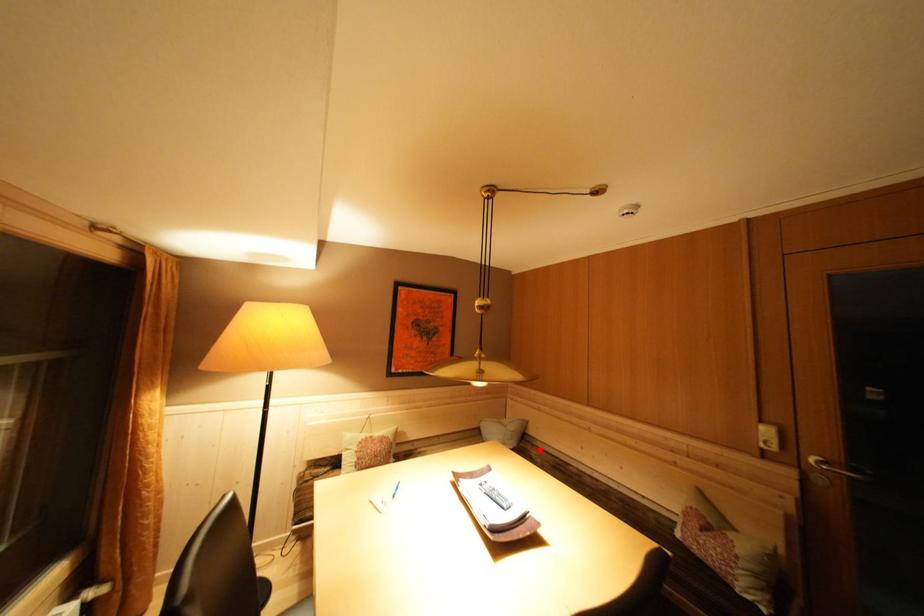
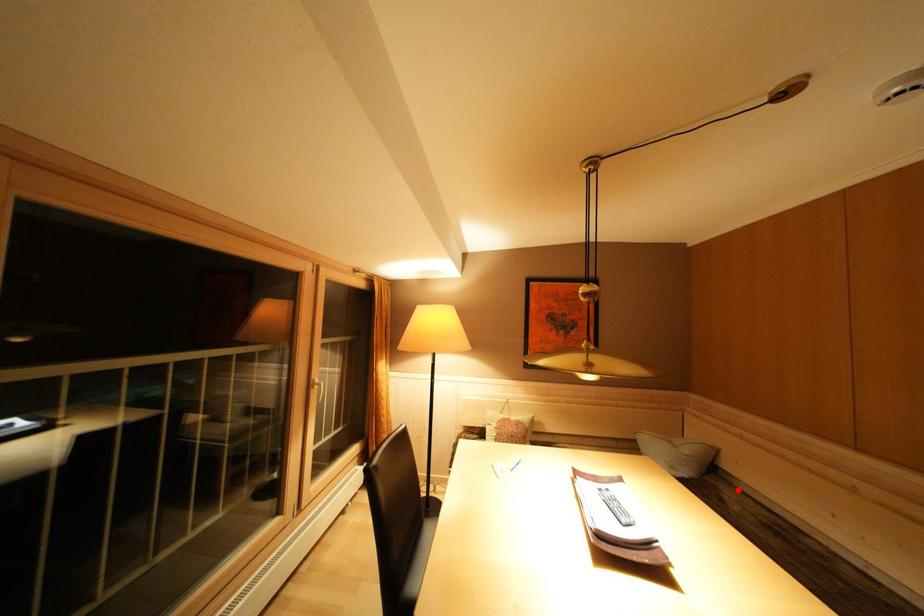
I am providing you with two images of the same scene from different viewpoints. A red point is marked on the first image and another point is marked on the second image. Is the red point in image1 aligned with the point shown in image2?

Yes